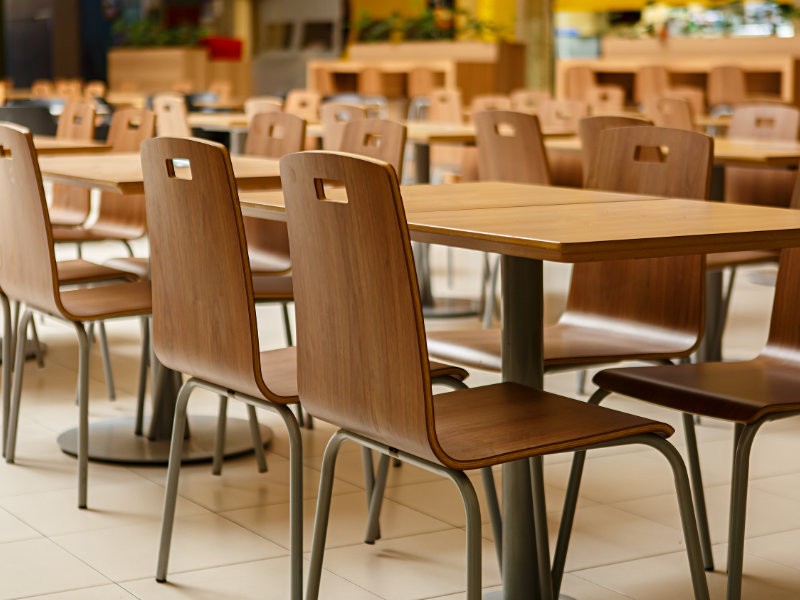
I want to click on table tops, so click(44, 137), click(102, 160), click(461, 190), click(550, 223), click(758, 146), click(570, 139), click(428, 124), click(220, 111).